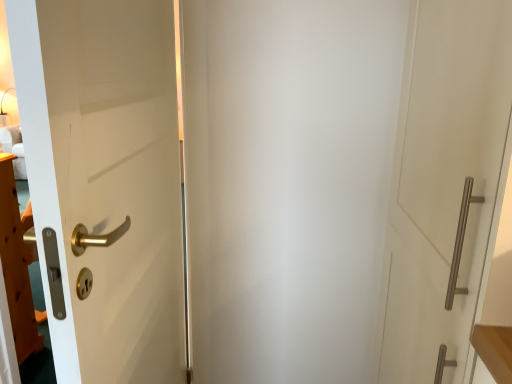
Question: Considering the positions of white matte door at left, positioned as the 1th door in left-to-right order, and satin nickel handle at right, which is counted as the first door, starting from the right, in the image, is white matte door at left, positioned as the 1th door in left-to-right order, wider or thinner than satin nickel handle at right, which is counted as the first door, starting from the right,?

Choices:
 (A) wide
 (B) thin

Answer: (B)

Question: Choose the correct answer: Is white matte door at left, positioned as the 1th door in left-to-right order, inside satin nickel handle at right, which is counted as the first door, starting from the right, or outside it?

Choices:
 (A) outside
 (B) inside

Answer: (A)

Question: Would you say white matte door at left, acting as the second door starting from the right, is to the left or to the right of satin nickel handle at right, which is counted as the first door, starting from the right, in the picture?

Choices:
 (A) left
 (B) right

Answer: (A)

Question: Is point (399, 311) closer or farther from the camera than point (19, 91)?

Choices:
 (A) farther
 (B) closer

Answer: (A)

Question: From the image's perspective, is satin nickel handle at right, the 2th door in the left-to-right sequence, positioned above or below white matte door at left, positioned as the 1th door in left-to-right order?

Choices:
 (A) above
 (B) below

Answer: (A)

Question: Relative to white matte door at left, acting as the second door starting from the right, is satin nickel handle at right, the 2th door in the left-to-right sequence, in front or behind?

Choices:
 (A) front
 (B) behind

Answer: (A)

Question: Considering the positions of satin nickel handle at right, the 2th door in the left-to-right sequence, and white matte door at left, positioned as the 1th door in left-to-right order, in the image, is satin nickel handle at right, the 2th door in the left-to-right sequence, taller or shorter than white matte door at left, positioned as the 1th door in left-to-right order,?

Choices:
 (A) tall
 (B) short

Answer: (B)